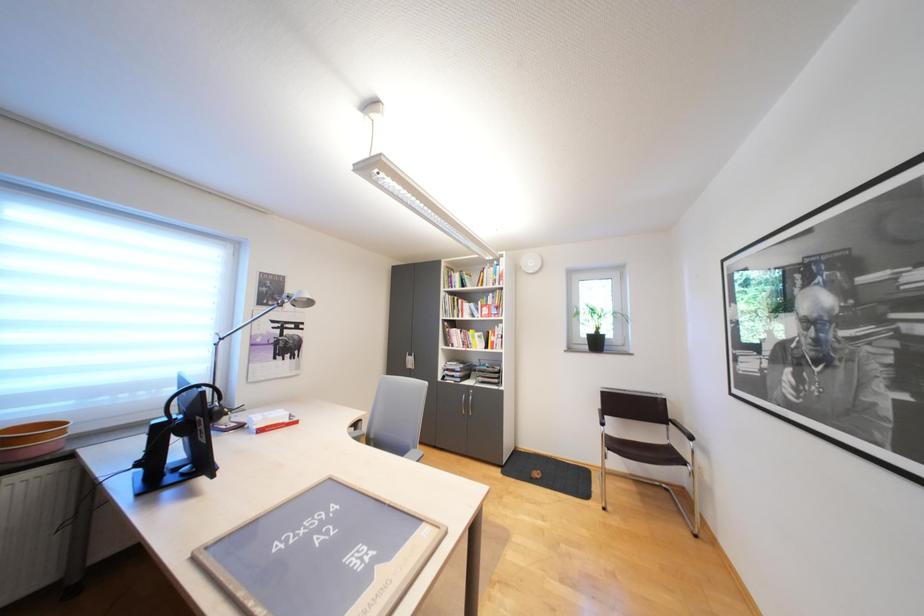
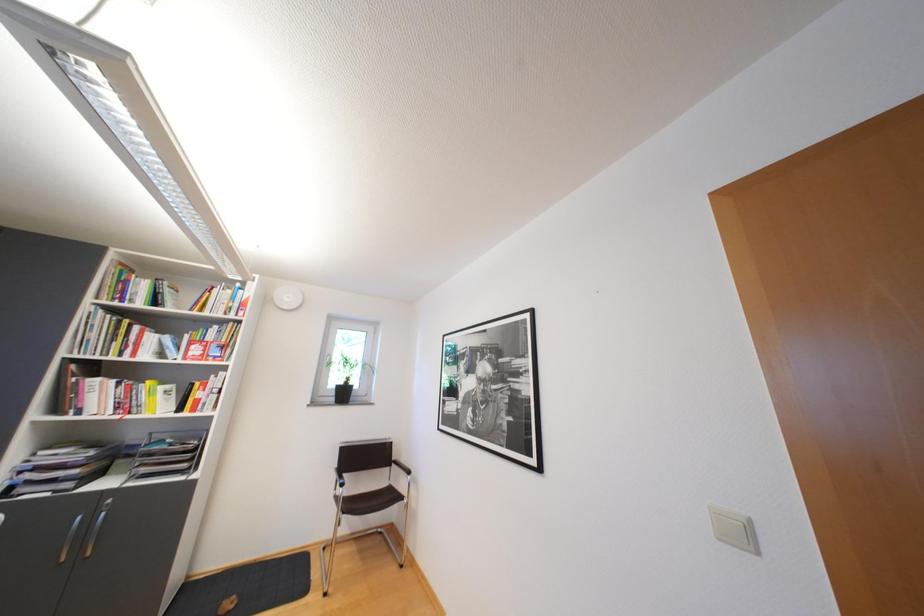
Question: The first image is from the beginning of the video and the second image is from the end. How did the camera likely rotate when shooting the video?

Choices:
 (A) Left
 (B) Right
 (C) Up
 (D) Down

Answer: (B)